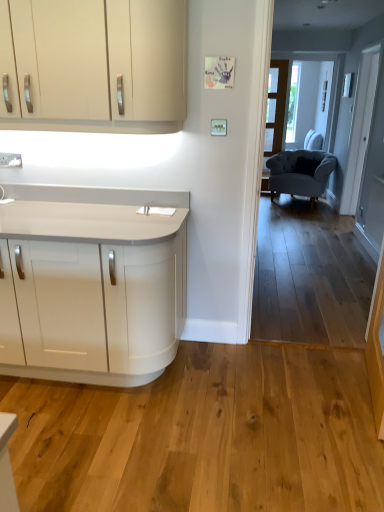
Question: Considering the relative sizes of white glossy countertop at lower left and velvet grey armchair at right in the image provided, is white glossy countertop at lower left wider than velvet grey armchair at right?

Choices:
 (A) yes
 (B) no

Answer: (B)

Question: Considering the relative sizes of white glossy countertop at lower left and velvet grey armchair at right in the image provided, is white glossy countertop at lower left bigger than velvet grey armchair at right?

Choices:
 (A) yes
 (B) no

Answer: (A)

Question: Is white glossy countertop at lower left completely or partially outside of velvet grey armchair at right?

Choices:
 (A) yes
 (B) no

Answer: (A)

Question: Are white glossy countertop at lower left and velvet grey armchair at right making contact?

Choices:
 (A) yes
 (B) no

Answer: (B)

Question: Is velvet grey armchair at right at the back of white glossy countertop at lower left?

Choices:
 (A) no
 (B) yes

Answer: (B)

Question: From a real-world perspective, is velvet grey armchair at right positioned above or below clear glass door at center?

Choices:
 (A) above
 (B) below

Answer: (B)

Question: Visually, is velvet grey armchair at right positioned to the left or to the right of clear glass door at center?

Choices:
 (A) right
 (B) left

Answer: (A)

Question: Considering the positions of velvet grey armchair at right and clear glass door at center in the image, is velvet grey armchair at right wider or thinner than clear glass door at center?

Choices:
 (A) wide
 (B) thin

Answer: (A)

Question: Which is correct: velvet grey armchair at right is inside clear glass door at center, or outside of it?

Choices:
 (A) outside
 (B) inside

Answer: (A)

Question: Considering the positions of matte white cabinets at upper left and white glossy countertop at lower left in the image, is matte white cabinets at upper left wider or thinner than white glossy countertop at lower left?

Choices:
 (A) wide
 (B) thin

Answer: (B)

Question: From a real-world perspective, is matte white cabinets at upper left positioned above or below white glossy countertop at lower left?

Choices:
 (A) above
 (B) below

Answer: (A)

Question: Based on their sizes in the image, would you say matte white cabinets at upper left is bigger or smaller than white glossy countertop at lower left?

Choices:
 (A) small
 (B) big

Answer: (A)

Question: Considering the positions of matte white cabinets at upper left and white glossy countertop at lower left in the image, is matte white cabinets at upper left taller or shorter than white glossy countertop at lower left?

Choices:
 (A) short
 (B) tall

Answer: (A)

Question: Is white glossy countertop at lower left bigger or smaller than matte white cabinets at upper left?

Choices:
 (A) small
 (B) big

Answer: (B)

Question: From the image's perspective, relative to matte white cabinets at upper left, is white glossy countertop at lower left above or below?

Choices:
 (A) below
 (B) above

Answer: (A)